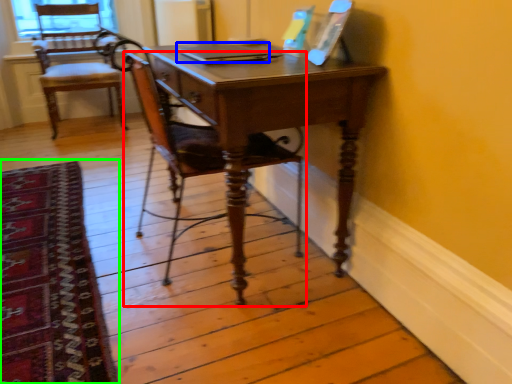
Question: Which object is the closest to the chair (highlighted by a red box)? Choose among these: laptop (highlighted by a blue box) or mat (highlighted by a green box).

Choices:
 (A) laptop
 (B) mat

Answer: (A)